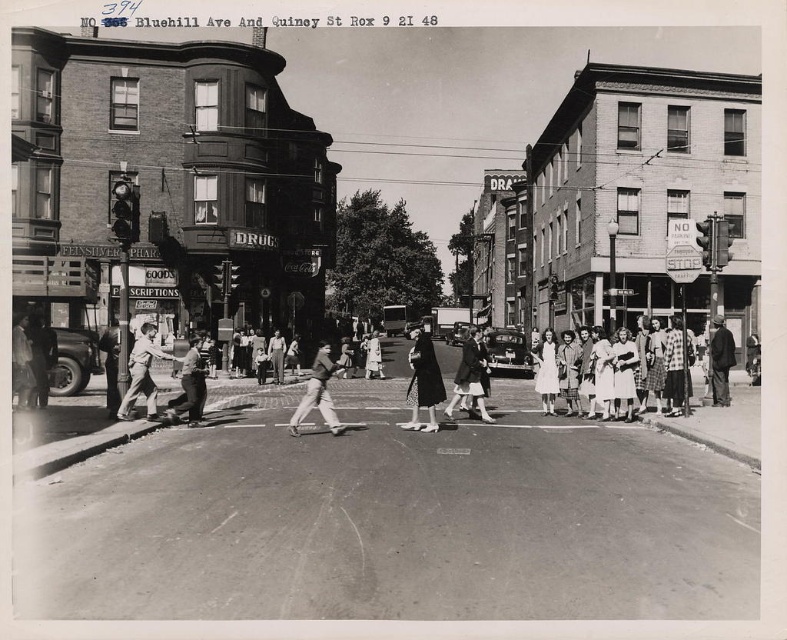
You are a tailor observing two customers in the image. The first customer is wearing a matte gray suit at center, and the second is wearing a matte black jacket at left. Which customer is taller?

The matte gray suit at center has a greater height compared to the matte black jacket at left, so the customer wearing the matte gray suit at center is taller.

Based on the photo, you are a photographer standing at the intersection of Bluehill Avenue and Quincy Street in 1948. You notice a matte black dress at center and a matte black truck at left. Which object appears narrower in the photograph?

The matte black dress at center appears narrower than the matte black truck at left in the photograph.

You are a photographer standing at the intersection of Bluehill Avenue and Quincy Street in 1948. You want to take a photo of the matte gray suit at center. Where should you position yourself to capture the subject in the frame?

The matte gray suit at center is located at coordinates point (141, 372), so you should position yourself directly facing that point to capture it in the frame.